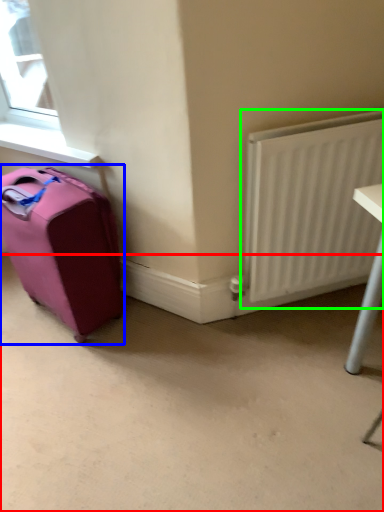
Question: Which object is positioned closest to concrete (highlighted by a red box)? Select from luggage and bags (highlighted by a blue box) and radiator (highlighted by a green box).

Choices:
 (A) luggage and bags
 (B) radiator

Answer: (A)